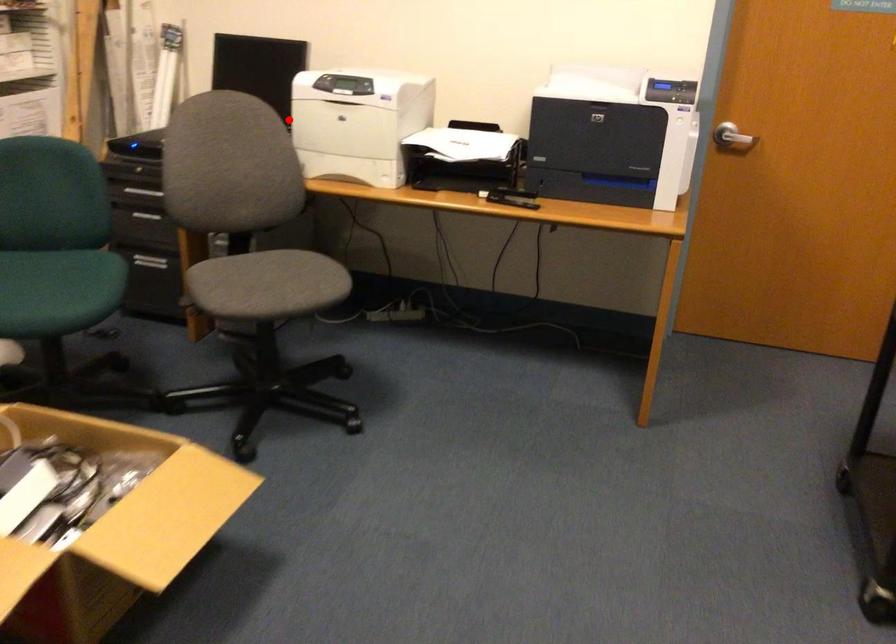
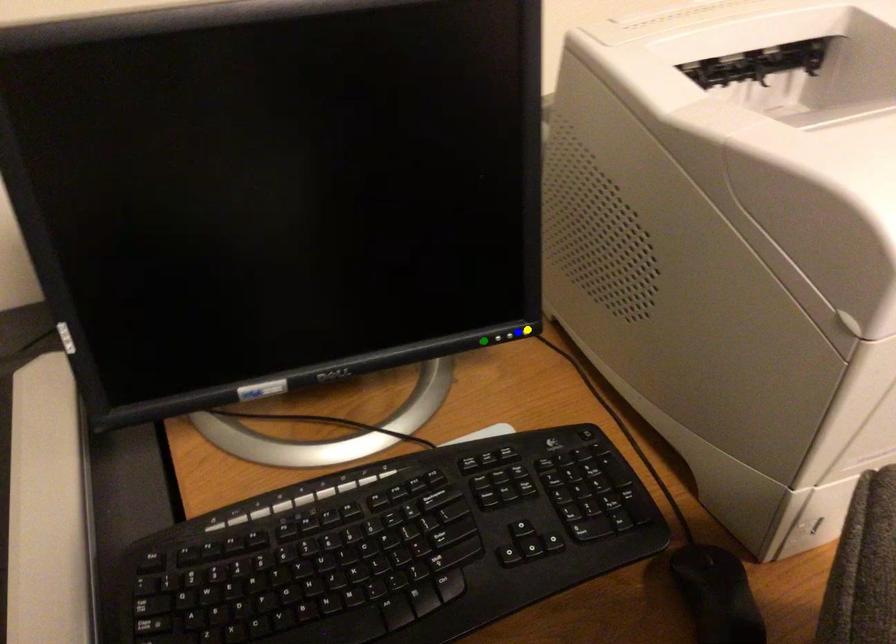
Question: I am providing you with two images of the same scene from different viewpoints. A red point is marked on the first image. You are given multiple points on the second image. Which mark in image 2 goes with the point in image 1?

Choices:
 (A) yellow point
 (B) blue point
 (C) green point

Answer: (C)